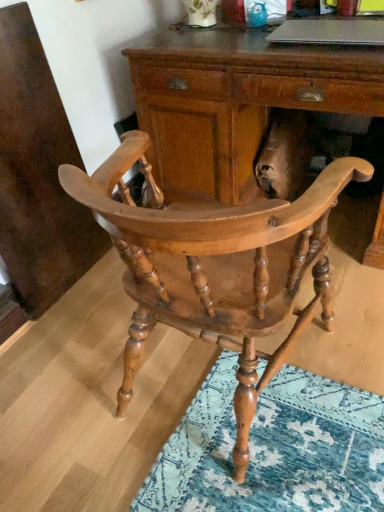
Image resolution: width=384 pixels, height=512 pixels. Describe the element at coordinates (216, 267) in the screenshot. I see `natural wood chair at center` at that location.

What do you see at coordinates (235, 101) in the screenshot? Image resolution: width=384 pixels, height=512 pixels. I see `wooden desk at center` at bounding box center [235, 101].

Find the location of a particular element. natural wood chair at center is located at coordinates (216, 267).

From the image's perspective, which one is positioned lower, silver metallic laptop at upper center or wooden desk at center?

wooden desk at center is shown below in the image.

Considering the relative sizes of silver metallic laptop at upper center and wooden desk at center in the image provided, is silver metallic laptop at upper center taller than wooden desk at center?

Incorrect, the height of silver metallic laptop at upper center is not larger of that of wooden desk at center.

Is wooden desk at center at the back of silver metallic laptop at upper center?

silver metallic laptop at upper center does not have its back to wooden desk at center.

Consider the image. Can you confirm if silver metallic laptop at upper center is smaller than wooden desk at center?

Indeed, silver metallic laptop at upper center has a smaller size compared to wooden desk at center.

Would you say natural wood chair at center is inside or outside silver metallic laptop at upper center?

natural wood chair at center is not enclosed by silver metallic laptop at upper center.

Measure the distance between natural wood chair at center and silver metallic laptop at upper center.

The distance of natural wood chair at center from silver metallic laptop at upper center is 95.84 centimeters.

Would you say natural wood chair at center is to the left or to the right of silver metallic laptop at upper center in the picture?

Based on their positions, natural wood chair at center is located to the left of silver metallic laptop at upper center.

From a real-world perspective, is natural wood chair at center physically located above or below silver metallic laptop at upper center?

In terms of real-world spatial position, natural wood chair at center is below silver metallic laptop at upper center.

Is wooden desk at center looking in the opposite direction of silver metallic laptop at upper center?

wooden desk at center is not turned away from silver metallic laptop at upper center.

Does point (245, 34) lie in front of point (278, 35)?

No, it is not.

Looking at the image, does wooden desk at center seem bigger or smaller compared to silver metallic laptop at upper center?

In the image, wooden desk at center appears to be larger than silver metallic laptop at upper center.

Is wooden desk at center situated inside silver metallic laptop at upper center or outside?

wooden desk at center is spatially situated outside silver metallic laptop at upper center.

Is silver metallic laptop at upper center wider or thinner than natural wood chair at center?

In the image, silver metallic laptop at upper center appears to be more narrow than natural wood chair at center.

In the scene shown: From the image's perspective, which one is positioned lower, silver metallic laptop at upper center or natural wood chair at center?

natural wood chair at center.

From a real-world perspective, is silver metallic laptop at upper center positioned under natural wood chair at center based on gravity?

Actually, silver metallic laptop at upper center is physically above natural wood chair at center in the real world.

Is wooden desk at center positioned before natural wood chair at center?

No, wooden desk at center is further to the viewer.

Is natural wood chair at center at the back of wooden desk at center?

No.

You are a GUI agent. You are given a task and a screenshot of the screen. Output one action in this format:
    pyautogui.click(x=<x>, y=<y>)
    Task: Click on the chair lying below the wooden desk at center (from the image's perspective)
    
    Given the screenshot: What is the action you would take?
    pyautogui.click(x=216, y=267)

Between wooden desk at center and natural wood chair at center, which one has smaller width?

Thinner between the two is natural wood chair at center.

How far apart are natural wood chair at center and wooden desk at center?

natural wood chair at center is 28.64 inches from wooden desk at center.

Could you tell me if natural wood chair at center is facing wooden desk at center?

Yes, natural wood chair at center is oriented towards wooden desk at center.

Is natural wood chair at center bigger than wooden desk at center?

No.

Is natural wood chair at center next to wooden desk at center and touching it?

No, natural wood chair at center is not making contact with wooden desk at center.

Where is `computer behind the wooden desk at center`? computer behind the wooden desk at center is located at coordinates [330, 31].

The height and width of the screenshot is (512, 384). In order to click on computer lying on the right of natural wood chair at center in this screenshot , I will do `click(330, 31)`.

Based on their spatial positions, is wooden desk at center or natural wood chair at center closer to silver metallic laptop at upper center?

The object closer to silver metallic laptop at upper center is wooden desk at center.

Consider the image. From the image, which object appears to be nearer to silver metallic laptop at upper center, natural wood chair at center or wooden desk at center?

Among the two, wooden desk at center is located nearer to silver metallic laptop at upper center.

Considering their positions, is wooden desk at center positioned closer to natural wood chair at center than silver metallic laptop at upper center?

Based on the image, wooden desk at center appears to be nearer to natural wood chair at center.

Looking at the image, which one is located further to natural wood chair at center, silver metallic laptop at upper center or wooden desk at center?

silver metallic laptop at upper center is positioned further to the anchor natural wood chair at center.

Estimate the real-world distances between objects in this image. Which object is further from wooden desk at center, silver metallic laptop at upper center or natural wood chair at center?

natural wood chair at center.

When comparing their distances from wooden desk at center, does natural wood chair at center or silver metallic laptop at upper center seem further?

natural wood chair at center is positioned further to the anchor wooden desk at center.

The image size is (384, 512). I want to click on desk between silver metallic laptop at upper center and natural wood chair at center in the vertical direction, so click(235, 101).